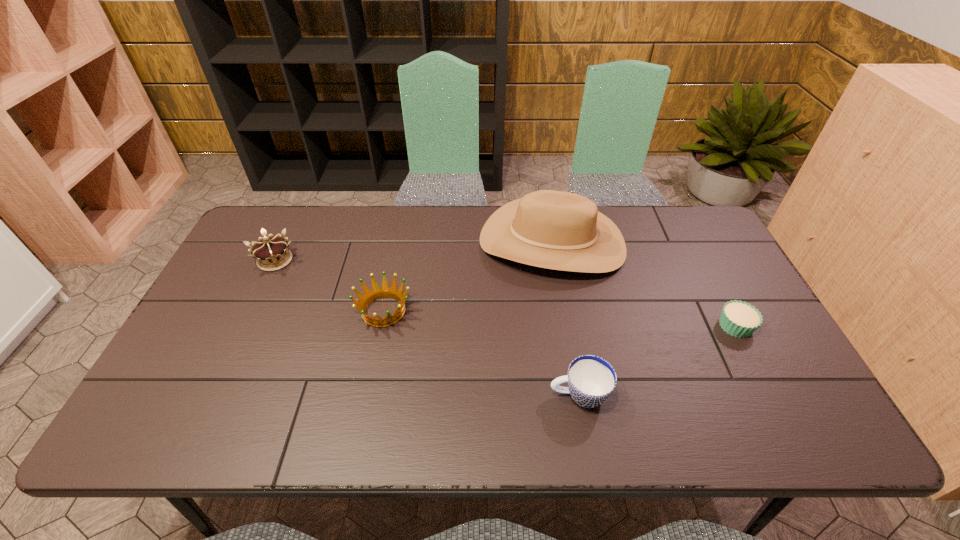
Find the location of a particular element. The height and width of the screenshot is (540, 960). vacant space located 0.290m on the side of the cup with the handle is located at coordinates (425, 395).

Find the location of a particular element. vacant space positioned on the side of the cup with the handle is located at coordinates (497, 395).

The width and height of the screenshot is (960, 540). I want to click on vacant space located on the side of the cup with the handle, so click(378, 395).

The width and height of the screenshot is (960, 540). What are the coordinates of `vacant area located 0.100m on the front of the nearer crown` in the screenshot? It's located at (372, 366).

Identify the location of free space located 0.180m on the front of the rightmost object. Image resolution: width=960 pixels, height=540 pixels. (776, 403).

Image resolution: width=960 pixels, height=540 pixels. What are the coordinates of `cowboy hat at the far edge` in the screenshot? It's located at (551, 229).

This screenshot has width=960, height=540. Find the location of `crown at the far edge`. crown at the far edge is located at coordinates (270, 252).

Find the location of `object that is at the near edge`. object that is at the near edge is located at coordinates (591, 380).

This screenshot has width=960, height=540. What are the coordinates of `object positioned at the left edge` in the screenshot? It's located at (270, 252).

Find the location of `object at the right edge`. object at the right edge is located at coordinates (740, 319).